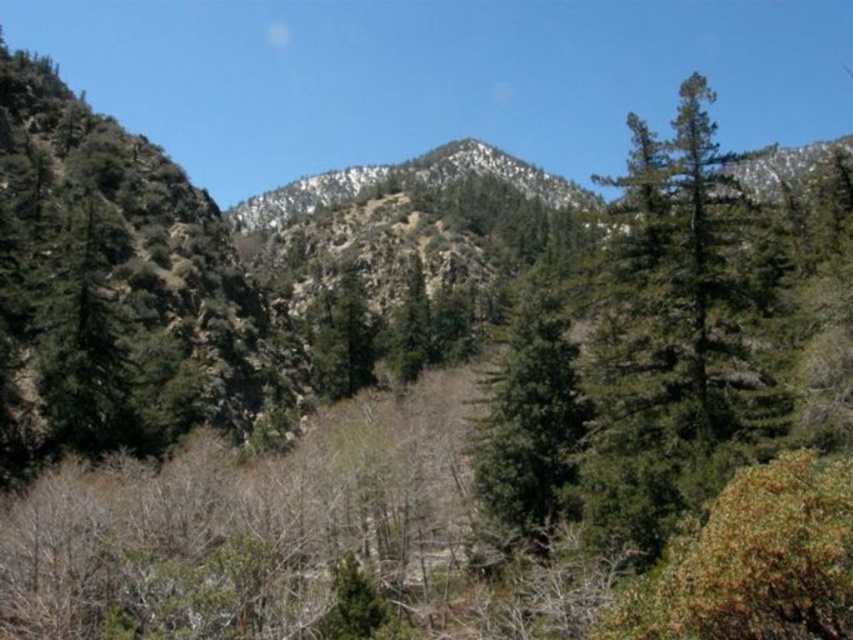
You are standing at the point marked as point (672, 337) in the mountainous landscape. What type of tree are you currently standing on?

The point (672, 337) is on a green needle like tree at right, so you are standing on a green needle like tree at right.

You are standing at the point labeled point (662, 300) and want to walk towards the point labeled point (502, 355). Given that both points are in the mountainous landscape described, which direction should you face to move towards your destination?

You should face upwards because point (502, 355) is further away from the viewer compared to point (662, 300), so moving towards it would require going into the background of the scene.